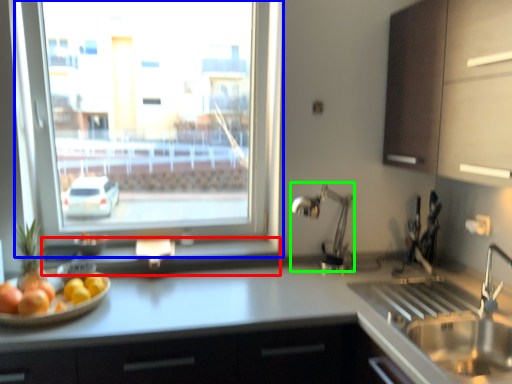
Question: Based on their relative distances, which object is nearer to window sill (highlighted by a red box)? Choose from window (highlighted by a blue box) and faucet (highlighted by a green box).

Choices:
 (A) window
 (B) faucet

Answer: (B)